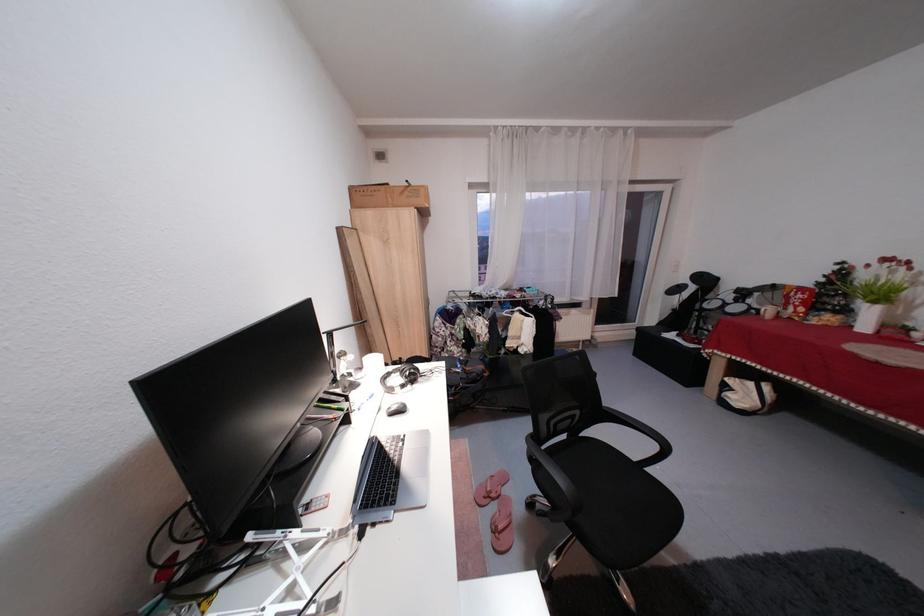
The image size is (924, 616). Describe the element at coordinates (388, 196) in the screenshot. I see `the cardboard box` at that location.